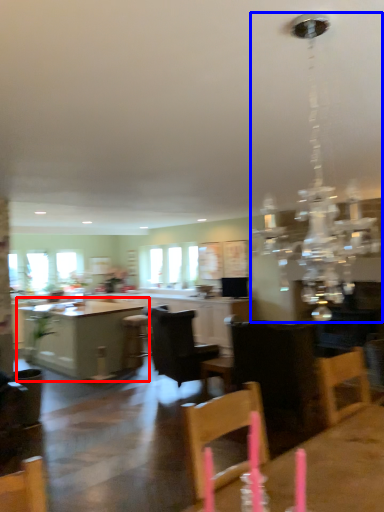
Question: Which point is closer to the camera, table (highlighted by a red box) or light fixture (highlighted by a blue box)?

Choices:
 (A) table
 (B) light fixture

Answer: (B)